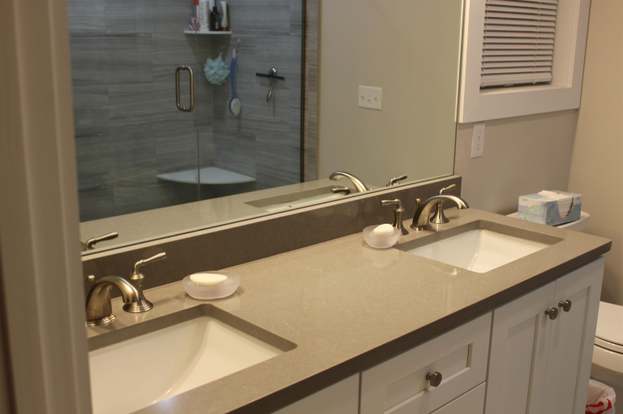
Locate an element on the screen. Image resolution: width=623 pixels, height=414 pixels. sinks is located at coordinates (154, 369), (478, 256).